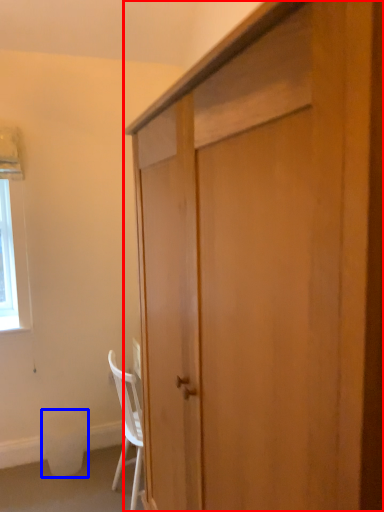
Question: Which point is further to the camera, cabinetry (highlighted by a red box) or trash bin/can (highlighted by a blue box)?

Choices:
 (A) cabinetry
 (B) trash bin/can

Answer: (B)